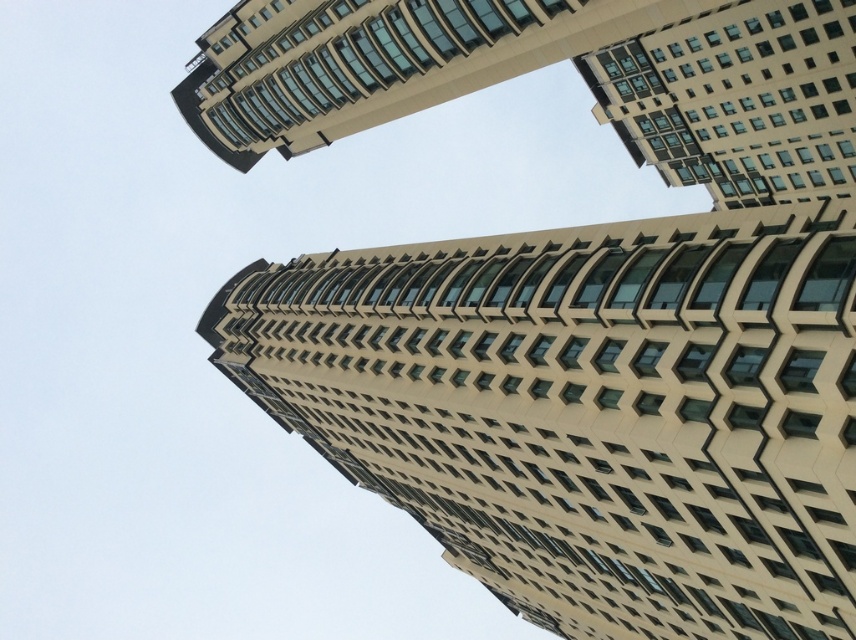
Is beige concrete building at center wider than beige glass building at upper center?

No.

Is point (657, 604) positioned before point (632, 157)?

Yes.

What do you see at coordinates (589, 410) in the screenshot?
I see `beige concrete building at center` at bounding box center [589, 410].

Identify the location of beige concrete building at center. (589, 410).